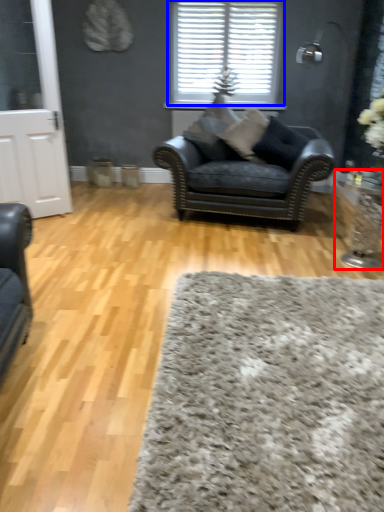
Question: Which object appears closest to the camera in this image, side table (highlighted by a red box) or window (highlighted by a blue box)?

Choices:
 (A) side table
 (B) window

Answer: (A)